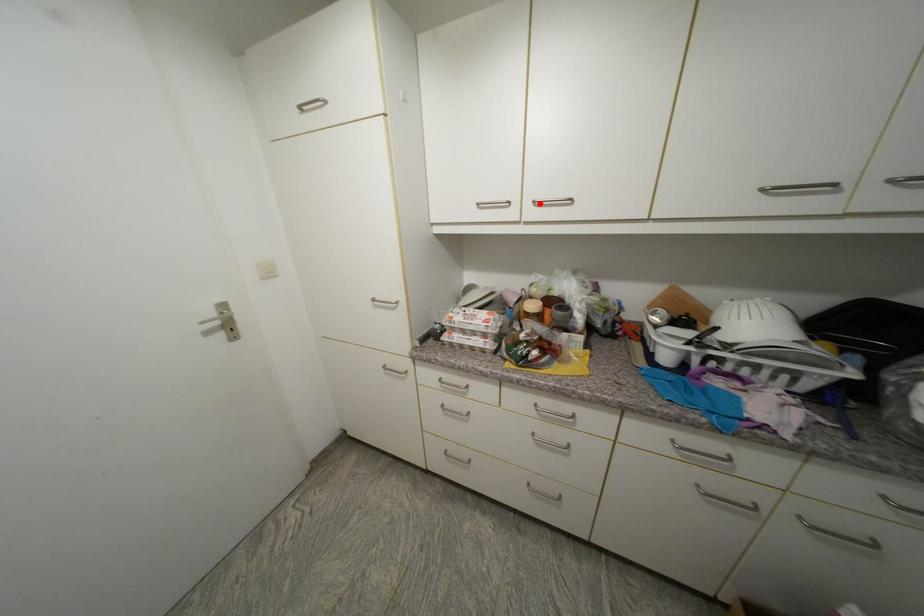
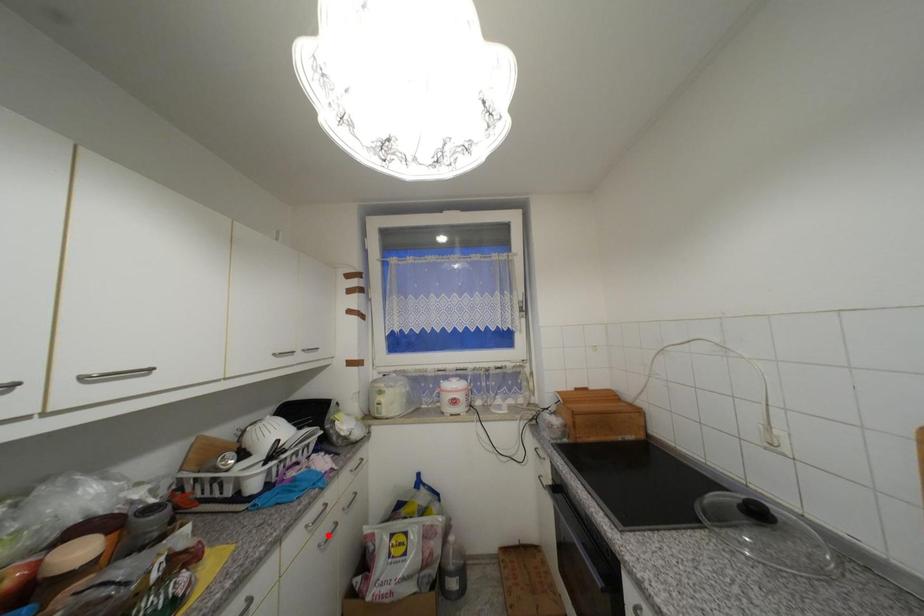
I am providing you with two images of the same scene from different viewpoints. A red point is marked on the first image and another point is marked on the second image. Is the red point in image1 aligned with the point shown in image2?

No